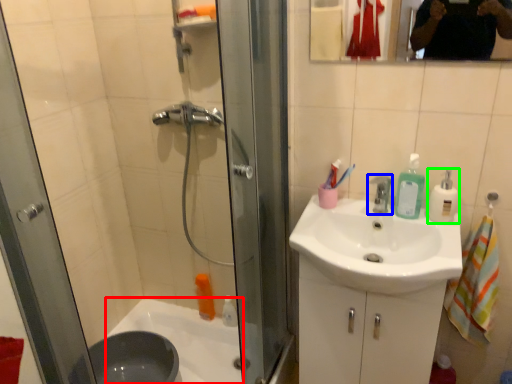
Question: Considering the real-world distances, which object is closest to bath (highlighted by a red box)? tap (highlighted by a blue box) or cleaning product (highlighted by a green box).

Choices:
 (A) tap
 (B) cleaning product

Answer: (A)